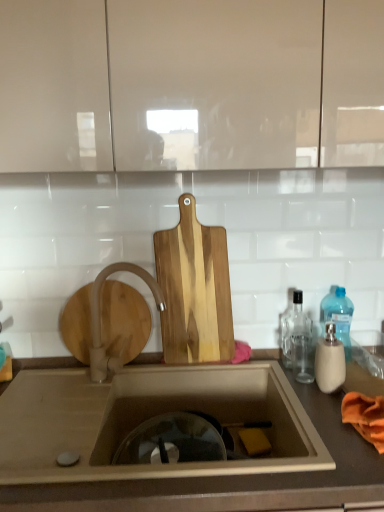
Identify the location of free spot to the left of beige matte soap dispenser at right, arranged as the first bottle when viewed from the front. (284, 387).